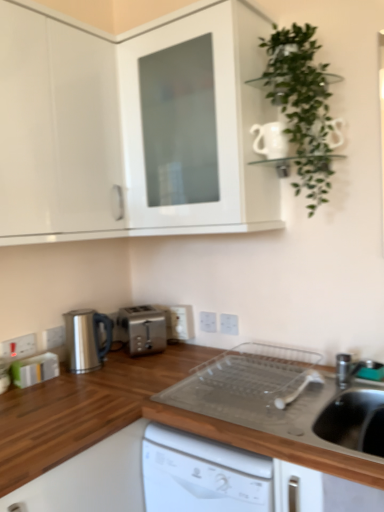
Question: Is green rubber tap at lower right facing towards white plastic electric outlet at center, marked as the 3th electric outlet in a right-to-left arrangement?

Choices:
 (A) no
 (B) yes

Answer: (A)

Question: Considering the relative sizes of green rubber tap at lower right and white plastic electric outlet at center, the 5th electric outlet when ordered from front to back, in the image provided, is green rubber tap at lower right smaller than white plastic electric outlet at center, the 5th electric outlet when ordered from front to back,?

Choices:
 (A) no
 (B) yes

Answer: (B)

Question: Can you confirm if green rubber tap at lower right is wider than white plastic electric outlet at center, the 1th electric outlet in the back-to-front sequence?

Choices:
 (A) no
 (B) yes

Answer: (A)

Question: Does green rubber tap at lower right lie in front of white plastic electric outlet at center, marked as the 3th electric outlet in a right-to-left arrangement?

Choices:
 (A) no
 (B) yes

Answer: (B)

Question: From a real-world perspective, is green rubber tap at lower right beneath white plastic electric outlet at center, the 5th electric outlet when ordered from front to back?

Choices:
 (A) no
 (B) yes

Answer: (B)

Question: Considering their positions, is green rubber tap at lower right located in front of or behind white glossy cabinet at upper left, which is counted as the 1th cabinetry, starting from the left?

Choices:
 (A) front
 (B) behind

Answer: (B)

Question: From a real-world perspective, is green rubber tap at lower right positioned above or below white glossy cabinet at upper left, which is counted as the 1th cabinetry, starting from the left?

Choices:
 (A) below
 (B) above

Answer: (A)

Question: From the image's perspective, relative to white glossy cabinet at upper left, which is counted as the 1th cabinetry, starting from the left, is green rubber tap at lower right above or below?

Choices:
 (A) below
 (B) above

Answer: (A)

Question: Is point (359, 372) positioned closer to the camera than point (3, 222)?

Choices:
 (A) closer
 (B) farther

Answer: (B)

Question: Is green rubber tap at lower right in front of or behind satin silver kettle at lower left in the image?

Choices:
 (A) front
 (B) behind

Answer: (A)

Question: In terms of height, does green rubber tap at lower right look taller or shorter compared to satin silver kettle at lower left?

Choices:
 (A) short
 (B) tall

Answer: (A)

Question: Based on their sizes in the image, would you say green rubber tap at lower right is bigger or smaller than satin silver kettle at lower left?

Choices:
 (A) big
 (B) small

Answer: (B)

Question: Is green rubber tap at lower right wider or thinner than satin silver kettle at lower left?

Choices:
 (A) thin
 (B) wide

Answer: (A)

Question: Is white glossy cabinet at upper center, which is the 1th cabinetry in right-to-left order, taller or shorter than white plastic electric outlet at lower left, arranged as the 2th electric outlet when viewed from the front?

Choices:
 (A) short
 (B) tall

Answer: (B)

Question: Is white glossy cabinet at upper center, which is the 1th cabinetry in right-to-left order, in front of or behind white plastic electric outlet at lower left, arranged as the fourth electric outlet when viewed from the back, in the image?

Choices:
 (A) front
 (B) behind

Answer: (A)